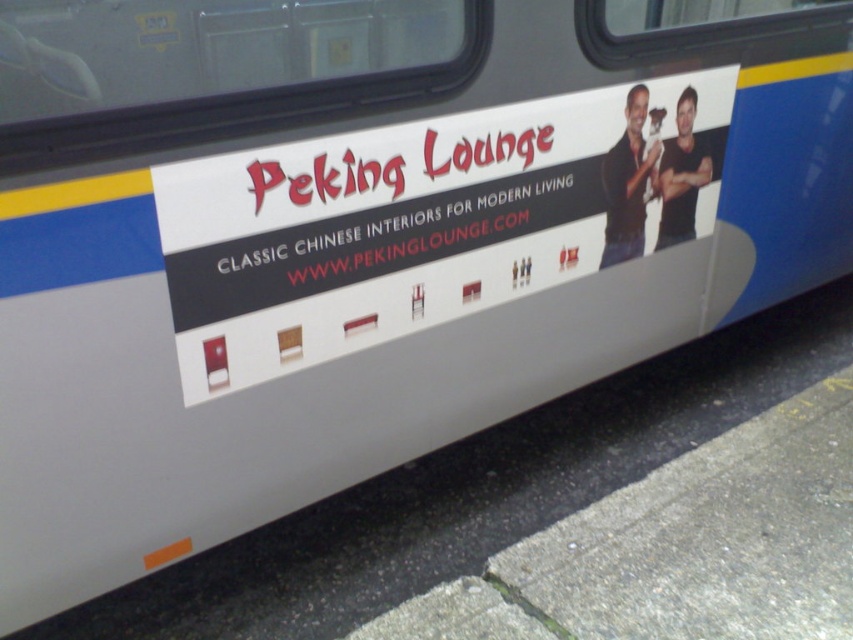
Question: Can you confirm if white matte signboard at center is wider than white matte text at center?

Choices:
 (A) yes
 (B) no

Answer: (A)

Question: Can you confirm if white matte signboard at center is positioned to the left of white matte text at center?

Choices:
 (A) no
 (B) yes

Answer: (A)

Question: Can you confirm if white matte signboard at center is positioned to the right of white matte text at center?

Choices:
 (A) no
 (B) yes

Answer: (B)

Question: Among these objects, which one is farthest from the camera?

Choices:
 (A) white matte signboard at center
 (B) white matte text at center

Answer: (B)

Question: Which of the following is the closest to the observer?

Choices:
 (A) white matte signboard at center
 (B) white matte text at center

Answer: (A)